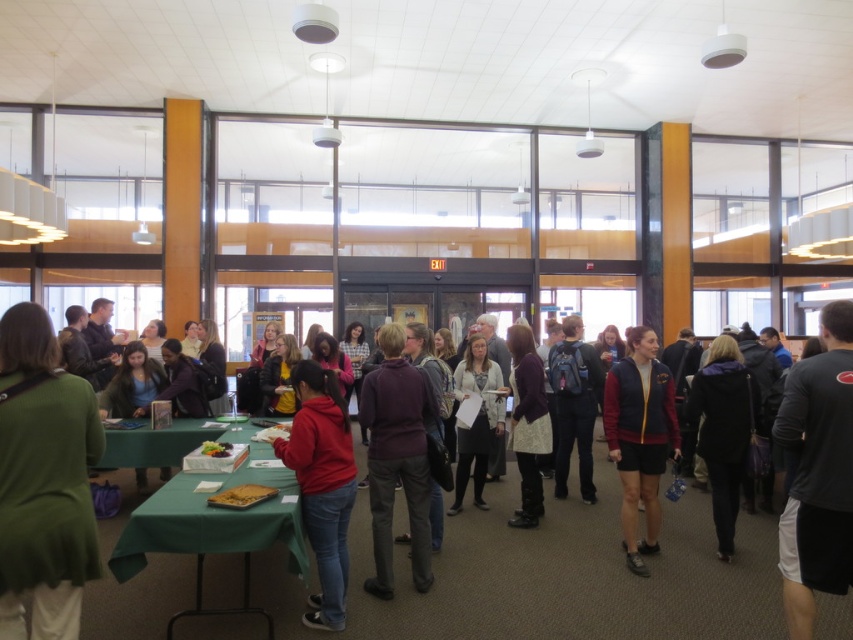
Question: Which object appears farthest from the camera in this image?

Choices:
 (A) maroon fleece jacket at center
 (B) black fabric jacket at center
 (C) matte red hoodie at center

Answer: (B)

Question: From the image, what is the correct spatial relationship of black cotton shirt at right in relation to matte purple sweater at center?

Choices:
 (A) left
 (B) right

Answer: (B)

Question: Is black cotton shirt at right smaller than green fabric table at lower left?

Choices:
 (A) no
 (B) yes

Answer: (B)

Question: From the image, what is the correct spatial relationship of maroon fleece jacket at center in relation to black fabric jacket at center?

Choices:
 (A) above
 (B) below

Answer: (A)

Question: Considering the real-world distances, which object is closest to the green fabric table at lower left?

Choices:
 (A) matte purple sweater at center
 (B) black fabric jacket at center
 (C) black cotton shirt at right

Answer: (A)

Question: Considering the real-world distances, which object is farthest from the green fabric table at lower left?

Choices:
 (A) black cotton shirt at right
 (B) matte red hoodie at center

Answer: (A)